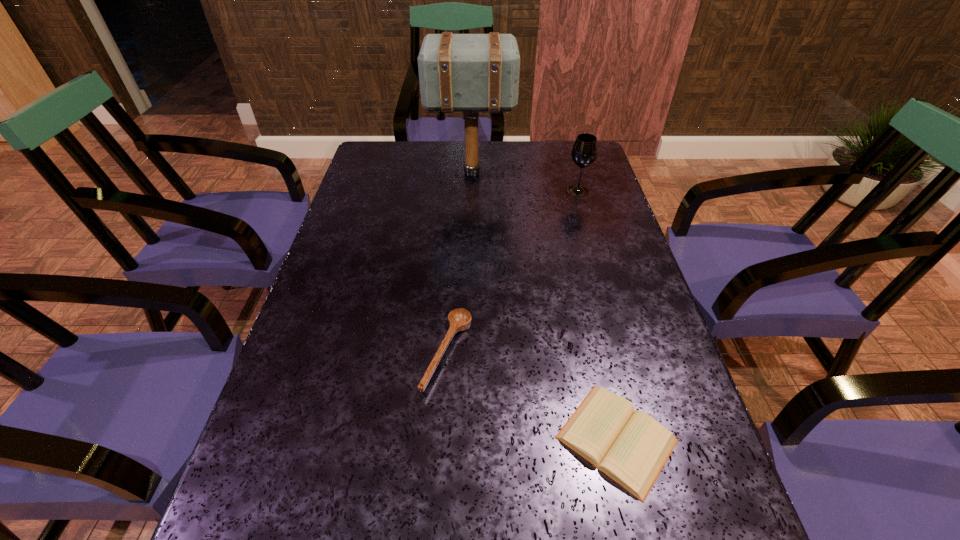
Locate an element on the screen. This screenshot has height=540, width=960. diary that is at the right edge is located at coordinates (631, 448).

I want to click on free region at the left edge of the desktop, so click(348, 397).

In the image, there is a desktop. Identify the location of free space at the right edge. (634, 525).

In order to click on vacant region at the far left corner of the desktop in this screenshot , I will do `click(390, 164)`.

This screenshot has height=540, width=960. What are the coordinates of `free space at the far right corner of the desktop` in the screenshot? It's located at (597, 176).

I want to click on free space between the tallest object and the wooden spoon, so click(x=459, y=263).

Identify the location of blank region between the second tallest object and the mallet. (524, 182).

Where is `vacant space that's between the second shortest object and the mallet`? The image size is (960, 540). vacant space that's between the second shortest object and the mallet is located at coordinates (459, 263).

Where is `free point between the mallet and the wineglass`? This screenshot has height=540, width=960. free point between the mallet and the wineglass is located at coordinates (524, 182).

Locate an element on the screen. The width and height of the screenshot is (960, 540). empty space between the second tallest object and the diary is located at coordinates (597, 315).